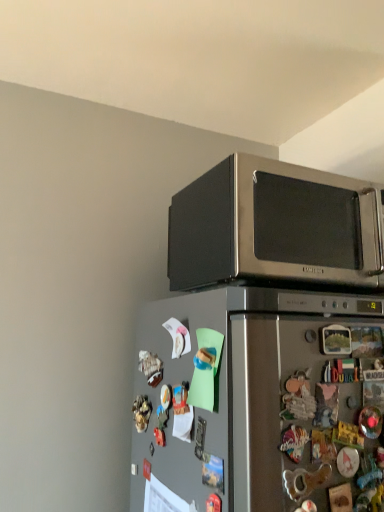
Question: Is stainless steel microwave at upper right not close to satin silver refrigerator at lower left?

Choices:
 (A) yes
 (B) no

Answer: (B)

Question: Is stainless steel microwave at upper right outside satin silver refrigerator at lower left?

Choices:
 (A) no
 (B) yes

Answer: (B)

Question: Is satin silver refrigerator at lower left inside stainless steel microwave at upper right?

Choices:
 (A) no
 (B) yes

Answer: (A)

Question: Is stainless steel microwave at upper right thinner than satin silver refrigerator at lower left?

Choices:
 (A) yes
 (B) no

Answer: (A)

Question: Does stainless steel microwave at upper right lie behind satin silver refrigerator at lower left?

Choices:
 (A) no
 (B) yes

Answer: (B)

Question: Considering the relative positions of stainless steel microwave at upper right and satin silver refrigerator at lower left in the image provided, is stainless steel microwave at upper right to the left of satin silver refrigerator at lower left from the viewer's perspective?

Choices:
 (A) yes
 (B) no

Answer: (B)

Question: From a real-world perspective, is satin silver refrigerator at lower left physically above stainless steel microwave at upper right?

Choices:
 (A) yes
 (B) no

Answer: (B)

Question: Is satin silver refrigerator at lower left oriented towards stainless steel microwave at upper right?

Choices:
 (A) yes
 (B) no

Answer: (B)

Question: Are satin silver refrigerator at lower left and stainless steel microwave at upper right located far from each other?

Choices:
 (A) yes
 (B) no

Answer: (B)

Question: Can you confirm if satin silver refrigerator at lower left is shorter than stainless steel microwave at upper right?

Choices:
 (A) yes
 (B) no

Answer: (B)

Question: Is the position of satin silver refrigerator at lower left more distant than that of stainless steel microwave at upper right?

Choices:
 (A) no
 (B) yes

Answer: (A)

Question: Is the position of satin silver refrigerator at lower left less distant than that of stainless steel microwave at upper right?

Choices:
 (A) yes
 (B) no

Answer: (A)

Question: Considering the positions of stainless steel microwave at upper right and satin silver refrigerator at lower left in the image, is stainless steel microwave at upper right wider or thinner than satin silver refrigerator at lower left?

Choices:
 (A) wide
 (B) thin

Answer: (B)